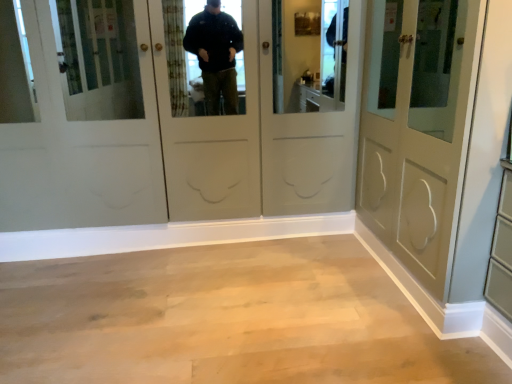
Question: Does point (381, 72) appear closer or farther from the camera than point (285, 254)?

Choices:
 (A) farther
 (B) closer

Answer: (B)

Question: Would you say matte gray door at right is inside or outside light wood floor at center?

Choices:
 (A) outside
 (B) inside

Answer: (A)

Question: From a real-world perspective, is matte gray door at right positioned above or below light wood floor at center?

Choices:
 (A) above
 (B) below

Answer: (A)

Question: In terms of height, does light wood floor at center look taller or shorter compared to matte gray door at right?

Choices:
 (A) short
 (B) tall

Answer: (A)

Question: Is light wood floor at center wider or thinner than matte gray door at right?

Choices:
 (A) wide
 (B) thin

Answer: (A)

Question: Does point (309, 370) appear closer or farther from the camera than point (424, 119)?

Choices:
 (A) farther
 (B) closer

Answer: (B)

Question: In the image, is light wood floor at center positioned in front of or behind matte gray door at right?

Choices:
 (A) behind
 (B) front

Answer: (A)